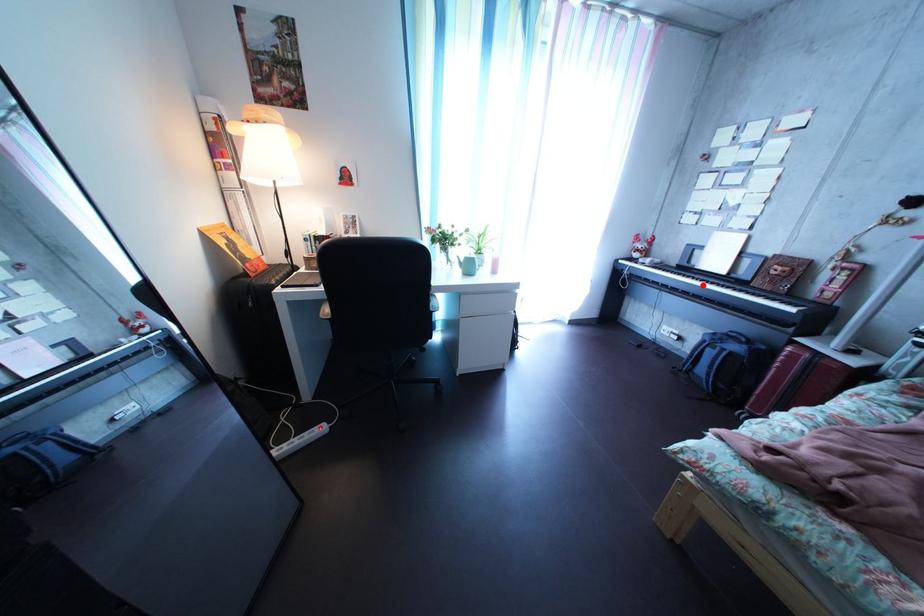
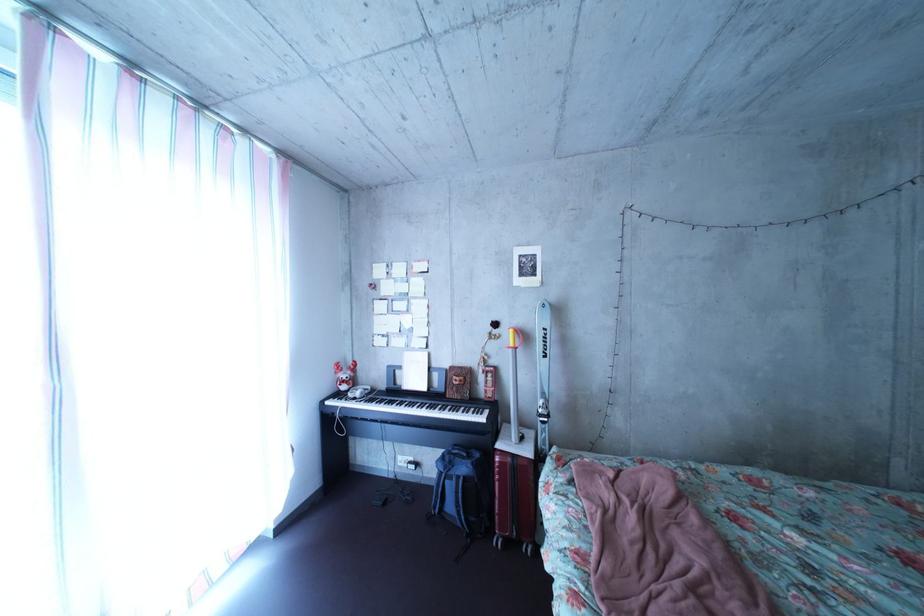
Question: I am providing you with two images of the same scene from different viewpoints. A red point is shown in image1. For the corresponding object point in image2, is it positioned nearer or farther from the camera?

Choices:
 (A) Nearer
 (B) Farther

Answer: (B)